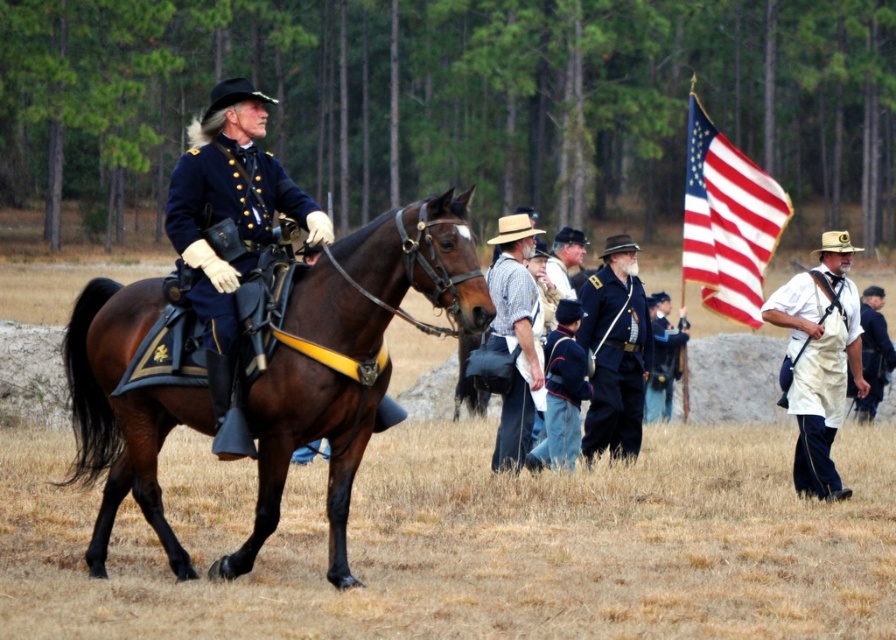
You are a photographer positioned in the center of the scene. You need to capture a photo that includes both the brown glossy horse at left and the white cotton overalls at right. Based on their heights, which object should you adjust your camera angle to focus on first to ensure both are in frame?

The brown glossy horse at left is shorter than the white cotton overalls at right. To include both in the frame, you should first focus on the shorter object, the brown glossy horse at left, and adjust the camera angle to capture its lower position while still including the taller white cotton overalls at right.

You are a photographer positioned in the woods observing the historical reenactment. You need to capture a photo where both the brown glossy horse at left and the white cotton overalls at right are visible. Based on their positions, will the horse block the view of the white cotton overalls?

The brown glossy horse at left is above the white cotton overalls at right, so the horse will not block the view of the white cotton overalls because they are positioned at different heights.